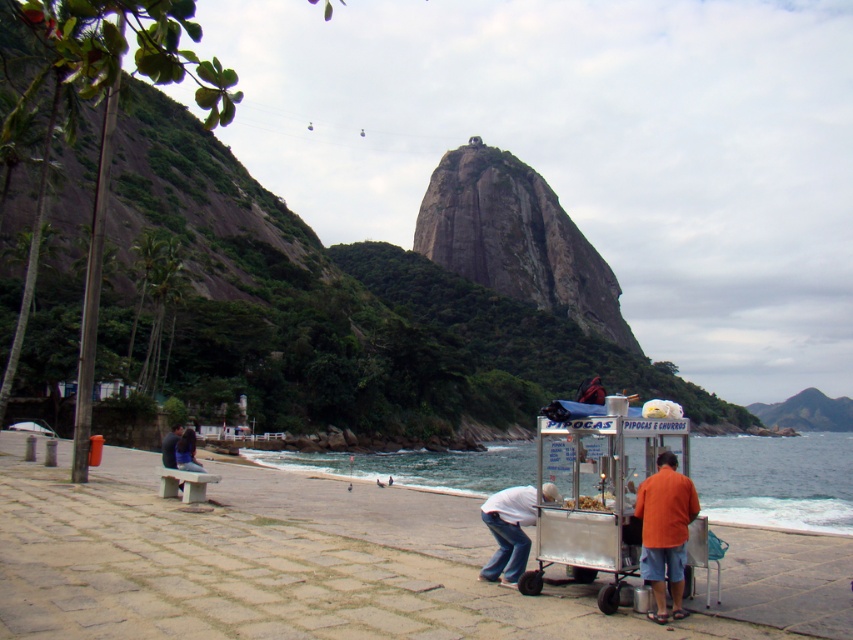
You are standing at the edge of the walkway and want to take a photo of the clear blue water at lower center. If your camera has a maximum focus range of 15 meters, will it be able to capture the water clearly?

The clear blue water at lower center is 15.18 meters away from the camera. Since the camera can only focus up to 15 meters, it may not capture the water clearly as the distance exceeds its maximum range.

You are a tourist standing at the edge of the walkway and want to buy some snacks from the metallic silver cart at lower center. Your friend wearing the white cotton shirt at lower center is standing 1.5 meters away from you. Can you both reach the cart without moving closer to each other?

The metallic silver cart at lower center is 1.56 meters away from the white cotton shirt at lower center. Since your friend is 1.5 meters away from you, the distance between you and the cart is slightly more than 1.56 meters minus your friend, but since the exact distance isn